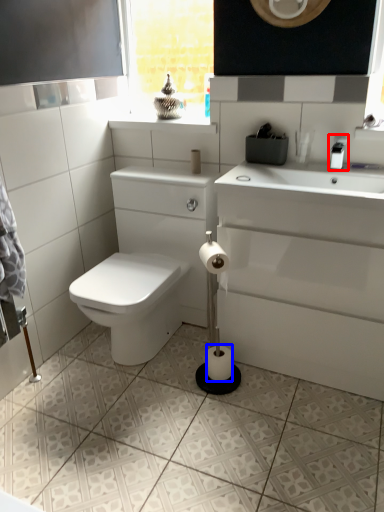
Question: Which object appears farthest to the camera in this image, faucet (highlighted by a red box) or toilet paper (highlighted by a blue box)?

Choices:
 (A) faucet
 (B) toilet paper

Answer: (B)